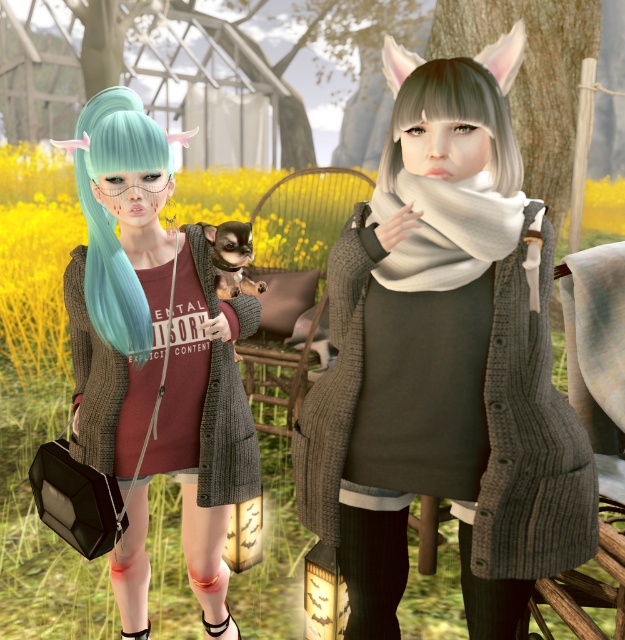
Question: Considering the real-world distances, which object is closest to the matte black cardigan at left?

Choices:
 (A) white soft scarf at center
 (B) teal matte hair at left

Answer: (B)

Question: Is knitted gray sweater at center above teal matte hair at left?

Choices:
 (A) yes
 (B) no

Answer: (B)

Question: Is white soft scarf at center behind smooth gray scarf at upper right?

Choices:
 (A) no
 (B) yes

Answer: (A)

Question: Can you confirm if matte black cardigan at left is positioned above teal matte hair at left?

Choices:
 (A) no
 (B) yes

Answer: (A)

Question: Based on their relative distances, which object is farther from the knitted gray sweater at center?

Choices:
 (A) matte black cardigan at left
 (B) white soft scarf at center
 (C) matte red t-shirt at left

Answer: (C)

Question: Which point is closer to the camera?

Choices:
 (A) knitted gray sweater at center
 (B) smooth gray scarf at upper right

Answer: (A)